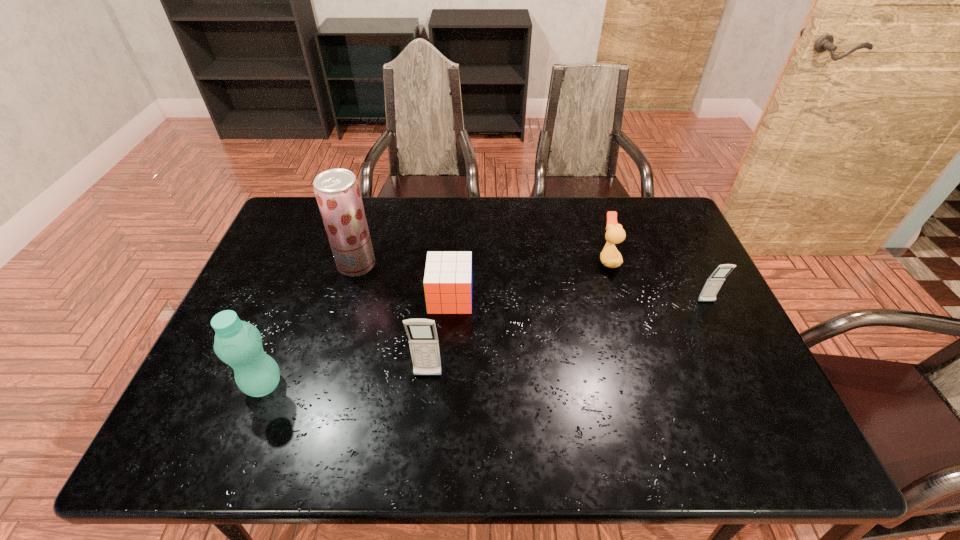
At what (x,y) coordinates should I click in order to perform the action: click on object at the right edge. Please return your answer as a coordinate pair (x, y). The height and width of the screenshot is (540, 960). Looking at the image, I should click on (713, 284).

The image size is (960, 540). I want to click on object located in the near left corner section of the desktop, so click(237, 343).

In the image, there is a desktop. At what (x,y) coordinates should I click in order to perform the action: click on free space at the far edge. Please return your answer as a coordinate pair (x, y). The width and height of the screenshot is (960, 540). Looking at the image, I should click on (391, 201).

I want to click on blank area at the near edge, so pyautogui.click(x=605, y=388).

At what (x,y) coordinates should I click in order to perform the action: click on vacant space at the left edge of the desktop. Please return your answer as a coordinate pair (x, y). The height and width of the screenshot is (540, 960). Looking at the image, I should click on (290, 261).

Identify the location of free location at the right edge of the desktop. The width and height of the screenshot is (960, 540). (692, 307).

Where is `vacant space at the far right corner of the desktop`? The width and height of the screenshot is (960, 540). vacant space at the far right corner of the desktop is located at coordinates (656, 210).

This screenshot has width=960, height=540. Identify the location of vacant region at the near right corner of the desktop. (738, 379).

The height and width of the screenshot is (540, 960). In order to click on empty space that is in between the cube and the bottle in this screenshot , I will do `click(357, 341)`.

Where is `vacant space that's between the leftmost object and the cube`? The width and height of the screenshot is (960, 540). vacant space that's between the leftmost object and the cube is located at coordinates (357, 341).